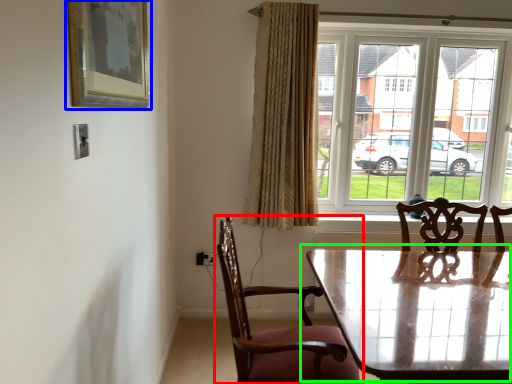
Question: Which object is the closest to the chair (highlighted by a red box)? Choose among these: picture frame (highlighted by a blue box) or table (highlighted by a green box).

Choices:
 (A) picture frame
 (B) table

Answer: (B)